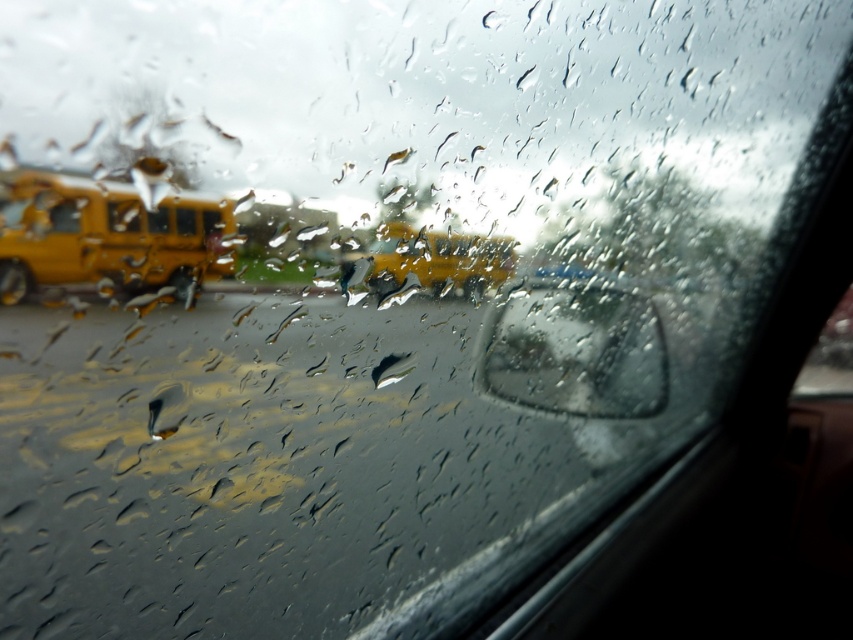
Measure the distance between matte yellow school bus at left and camera.

matte yellow school bus at left is 35.08 centimeters away from camera.

Does matte yellow school bus at left appear on the left side of yellow matte bus at left?

Indeed, matte yellow school bus at left is positioned on the left side of yellow matte bus at left.

The image size is (853, 640). In order to click on matte yellow school bus at left in this screenshot , I will do `click(107, 240)`.

Consider the image. Does matte yellow school bus at left have a greater height compared to transparent glass mirror at center?

No.

Is matte yellow school bus at left thinner than transparent glass mirror at center?

Indeed, matte yellow school bus at left has a lesser width compared to transparent glass mirror at center.

The height and width of the screenshot is (640, 853). What are the coordinates of `matte yellow school bus at left` in the screenshot? It's located at (107, 240).

Does point (122, 212) lie in front of point (149, 220)?

Yes, it is.

Who is more forward, (109,214) or (166,209)?

Point (109,214) is in front.

What do you see at coordinates (123, 216) in the screenshot? This screenshot has height=640, width=853. I see `yellow matte school bus at left` at bounding box center [123, 216].

What are the coordinates of `yellow matte school bus at left` in the screenshot? It's located at (123, 216).